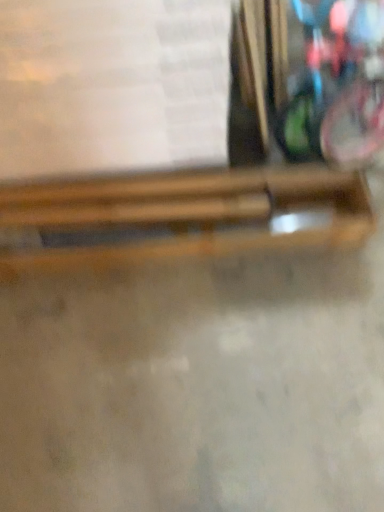
The height and width of the screenshot is (512, 384). Describe the element at coordinates (112, 85) in the screenshot. I see `white paper at upper center` at that location.

This screenshot has height=512, width=384. Find the location of `wooden chopsticks at center, which is the 1th wood from bottom to top`. wooden chopsticks at center, which is the 1th wood from bottom to top is located at coordinates (190, 214).

Is wooden chopsticks at center, which is the 1th wood from bottom to top, at the back of wooden chopsticks at center, which is the first wood in top-to-bottom order?

Yes, wooden chopsticks at center, which is the first wood in top-to-bottom order, is positioned with its back facing wooden chopsticks at center, which is the 1th wood from bottom to top.

Which of these two, wooden chopsticks at center, the second wood in the bottom-to-top sequence, or wooden chopsticks at center, which is counted as the second wood, starting from the top, is thinner?

wooden chopsticks at center, the second wood in the bottom-to-top sequence, is thinner.

Can you tell me how much wooden chopsticks at center, the second wood in the bottom-to-top sequence, and wooden chopsticks at center, which is the 1th wood from bottom to top, differ in facing direction?

The angular difference between wooden chopsticks at center, the second wood in the bottom-to-top sequence, and wooden chopsticks at center, which is the 1th wood from bottom to top, is 2.79 degrees.

Considering the positions of point (36, 210) and point (245, 236), is point (36, 210) closer or farther from the camera than point (245, 236)?

Clearly, point (36, 210) is more distant from the camera than point (245, 236).

Between wooden chopsticks at center, the second wood in the bottom-to-top sequence, and white paper at upper center, which one is positioned in front?

Positioned in front is white paper at upper center.

Between wooden chopsticks at center, which is the first wood in top-to-bottom order, and white paper at upper center, which one has smaller size?

wooden chopsticks at center, which is the first wood in top-to-bottom order, is smaller.

Is wooden chopsticks at center, the second wood in the bottom-to-top sequence, in contact with white paper at upper center?

No, wooden chopsticks at center, the second wood in the bottom-to-top sequence, is not next to white paper at upper center.

Considering the relative positions of wooden chopsticks at center, which is the first wood in top-to-bottom order, and white paper at upper center in the image provided, is wooden chopsticks at center, which is the first wood in top-to-bottom order, to the left of white paper at upper center from the viewer's perspective?

Incorrect, wooden chopsticks at center, which is the first wood in top-to-bottom order, is not on the left side of white paper at upper center.

Is white paper at upper center to the right of wooden chopsticks at center, which is the first wood in top-to-bottom order, from the viewer's perspective?

In fact, white paper at upper center is to the left of wooden chopsticks at center, which is the first wood in top-to-bottom order.

Who is bigger, white paper at upper center or wooden chopsticks at center, the second wood in the bottom-to-top sequence?

white paper at upper center.

In the scene shown: Measure the distance from white paper at upper center to wooden chopsticks at center, the second wood in the bottom-to-top sequence.

11.97 inches.

Looking at this image, which is correct: white paper at upper center is inside wooden chopsticks at center, which is the first wood in top-to-bottom order, or outside of it?

white paper at upper center cannot be found inside wooden chopsticks at center, which is the first wood in top-to-bottom order.

Considering the relative sizes of white paper at upper center and wooden chopsticks at center, which is the 1th wood from bottom to top, in the image provided, is white paper at upper center thinner than wooden chopsticks at center, which is the 1th wood from bottom to top,?

In fact, white paper at upper center might be wider than wooden chopsticks at center, which is the 1th wood from bottom to top.

Is white paper at upper center outside of wooden chopsticks at center, which is counted as the second wood, starting from the top?

Yes, white paper at upper center is not within wooden chopsticks at center, which is counted as the second wood, starting from the top.

Which of these two, white paper at upper center or wooden chopsticks at center, which is the 1th wood from bottom to top, stands taller?

white paper at upper center.

Does point (147, 60) lie behind point (369, 199)?

No, (147, 60) is closer to viewer.

Is wooden chopsticks at center, which is counted as the second wood, starting from the top, spatially inside wooden chopsticks at center, which is the first wood in top-to-bottom order, or outside of it?

wooden chopsticks at center, which is counted as the second wood, starting from the top, is not enclosed by wooden chopsticks at center, which is the first wood in top-to-bottom order.

Which object is closer to the camera taking this photo, wooden chopsticks at center, which is counted as the second wood, starting from the top, or wooden chopsticks at center, the second wood in the bottom-to-top sequence?

wooden chopsticks at center, which is counted as the second wood, starting from the top, is more forward.

Is wooden chopsticks at center, which is counted as the second wood, starting from the top, positioned with its back to wooden chopsticks at center, the second wood in the bottom-to-top sequence?

Absolutely, wooden chopsticks at center, which is counted as the second wood, starting from the top, is directed away from wooden chopsticks at center, the second wood in the bottom-to-top sequence.

Could you tell me if wooden chopsticks at center, which is the 1th wood from bottom to top, is turned towards white paper at upper center?

No, wooden chopsticks at center, which is the 1th wood from bottom to top, is not facing towards white paper at upper center.

From the image's perspective, who appears lower, wooden chopsticks at center, which is counted as the second wood, starting from the top, or white paper at upper center?

wooden chopsticks at center, which is counted as the second wood, starting from the top.

From a real-world perspective, count 1st woods downward from the white paper at upper center and point to it. Please provide its 2D coordinates.

[(190, 214)]

Consider the image. Could white paper at upper center be considered to be inside wooden chopsticks at center, which is the 1th wood from bottom to top?

No.

Find the location of a particular element. Image resolution: width=384 pixels, height=512 pixels. wood in front of the wooden chopsticks at center, which is the first wood in top-to-bottom order is located at coordinates (190, 214).

At what (x,y) coordinates should I click in order to perform the action: click on paperback book positioned vertically above the wooden chopsticks at center, the second wood in the bottom-to-top sequence (from a real-world perspective). Please return your answer as a coordinate pair (x, y). This screenshot has width=384, height=512. Looking at the image, I should click on (112, 85).

From the image, which object appears to be nearer to wooden chopsticks at center, which is counted as the second wood, starting from the top, wooden chopsticks at center, the second wood in the bottom-to-top sequence, or white paper at upper center?

wooden chopsticks at center, the second wood in the bottom-to-top sequence, is closer to wooden chopsticks at center, which is counted as the second wood, starting from the top.

When comparing their distances from wooden chopsticks at center, which is the 1th wood from bottom to top, does white paper at upper center or wooden chopsticks at center, which is the first wood in top-to-bottom order, seem further?

Based on the image, white paper at upper center appears to be further to wooden chopsticks at center, which is the 1th wood from bottom to top.

When comparing their distances from wooden chopsticks at center, the second wood in the bottom-to-top sequence, does wooden chopsticks at center, which is the 1th wood from bottom to top, or white paper at upper center seem closer?

wooden chopsticks at center, which is the 1th wood from bottom to top, lies closer to wooden chopsticks at center, the second wood in the bottom-to-top sequence, than the other object.

Based on their spatial positions, is wooden chopsticks at center, the second wood in the bottom-to-top sequence, or wooden chopsticks at center, which is counted as the second wood, starting from the top, closer to white paper at upper center?

The object closer to white paper at upper center is wooden chopsticks at center, which is counted as the second wood, starting from the top.

Looking at the image, which one is located closer to white paper at upper center, wooden chopsticks at center, which is counted as the second wood, starting from the top, or wooden chopsticks at center, the second wood in the bottom-to-top sequence?

wooden chopsticks at center, which is counted as the second wood, starting from the top, is closer to white paper at upper center.

When comparing their distances from wooden chopsticks at center, the second wood in the bottom-to-top sequence, does white paper at upper center or wooden chopsticks at center, which is counted as the second wood, starting from the top, seem closer?

wooden chopsticks at center, which is counted as the second wood, starting from the top.

Image resolution: width=384 pixels, height=512 pixels. Find the location of `wood between white paper at upper center and wooden chopsticks at center, which is counted as the second wood, starting from the top, in the up-down direction`. wood between white paper at upper center and wooden chopsticks at center, which is counted as the second wood, starting from the top, in the up-down direction is located at coordinates (143, 212).